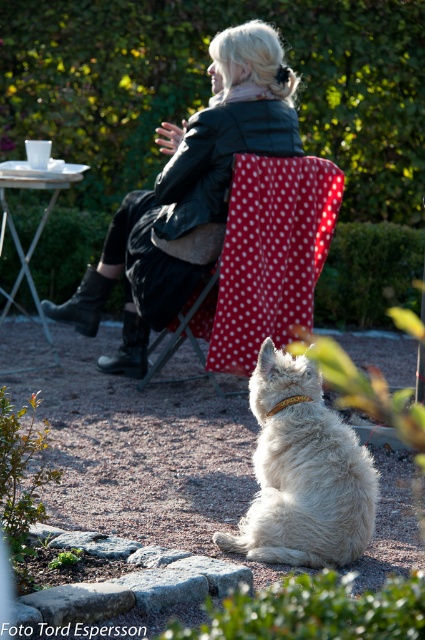
Question: From the image, what is the correct spatial relationship of leather jacket at center in relation to matte black neckband at upper center?

Choices:
 (A) below
 (B) above

Answer: (A)

Question: Is white fluffy dog at lower center below matte black neckband at upper center?

Choices:
 (A) yes
 (B) no

Answer: (A)

Question: Can you confirm if leather jacket at center is positioned to the right of white polka dot fabric chair at center?

Choices:
 (A) no
 (B) yes

Answer: (A)

Question: Among these points, which one is farthest from the camera?

Choices:
 (A) tap(102, 307)
 (B) tap(342, 435)

Answer: (A)

Question: Estimate the real-world distances between objects in this image. Which object is closer to the white polka dot fabric chair at center?

Choices:
 (A) leather jacket at center
 (B) gold leather neckband at lower center

Answer: (A)

Question: Which object is farther from the camera taking this photo?

Choices:
 (A) white fluffy dog at lower center
 (B) white polka dot fabric chair at center
 (C) leather jacket at center

Answer: (C)